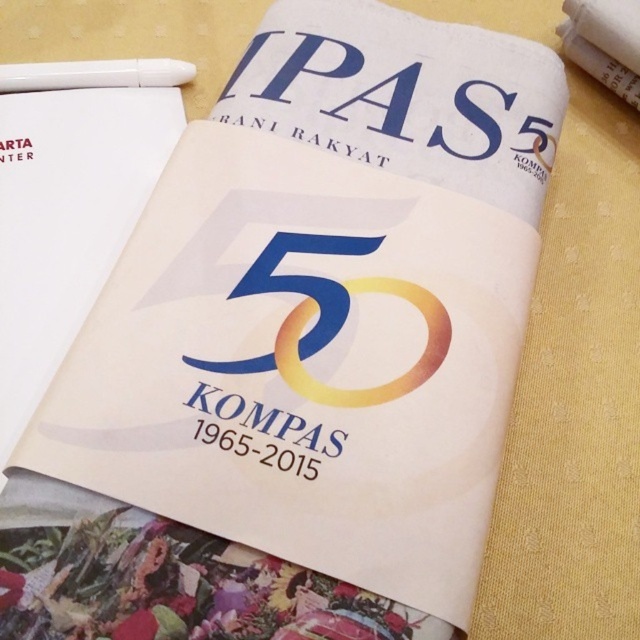
You are designing a layout for a promotional material and need to place the blue glossy number at center and the white plastic pen at upper left. Since you want to ensure proper spacing between them, can you determine which object requires more horizontal space?

The blue glossy number at center requires more horizontal space because its width surpasses that of the white plastic pen at upper left.